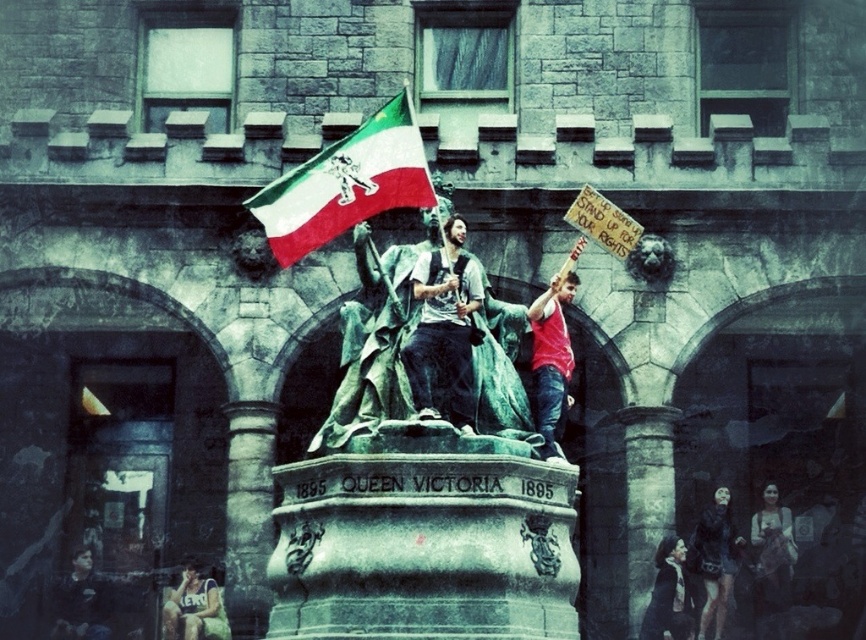
You are a photographer trying to capture a clear photo of the bronze statue at center and the matte blue tank top at lower left. Which object should you focus on first to ensure both are in focus?

The bronze statue at center is closer to the viewer than the matte blue tank top at lower left. To ensure both are in focus, you should focus on the bronze statue at center first, as it is closer, and the matte blue tank top at lower left will be in focus due to the depth of field extending backward.

You are a security guard observing the scene. You notice two people wearing jackets at the lower right corner of the statue area. Which jacket is taller between the black leather jacket at lower right and the dark brown leather jacket at lower right?

The black leather jacket at lower right is taller than the dark brown leather jacket at lower right according to the description.